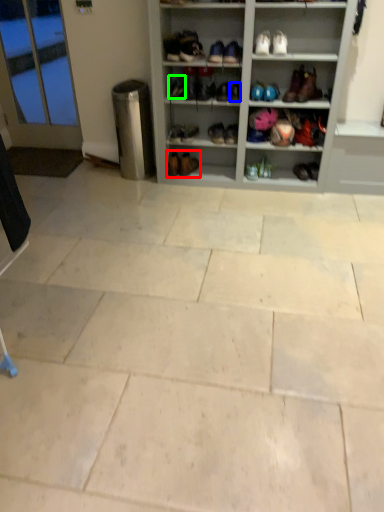
Question: Considering the real-world distances, which object is farthest from footwear (highlighted by a red box)? shoe (highlighted by a blue box) or shoe (highlighted by a green box)?

Choices:
 (A) shoe
 (B) shoe

Answer: (A)